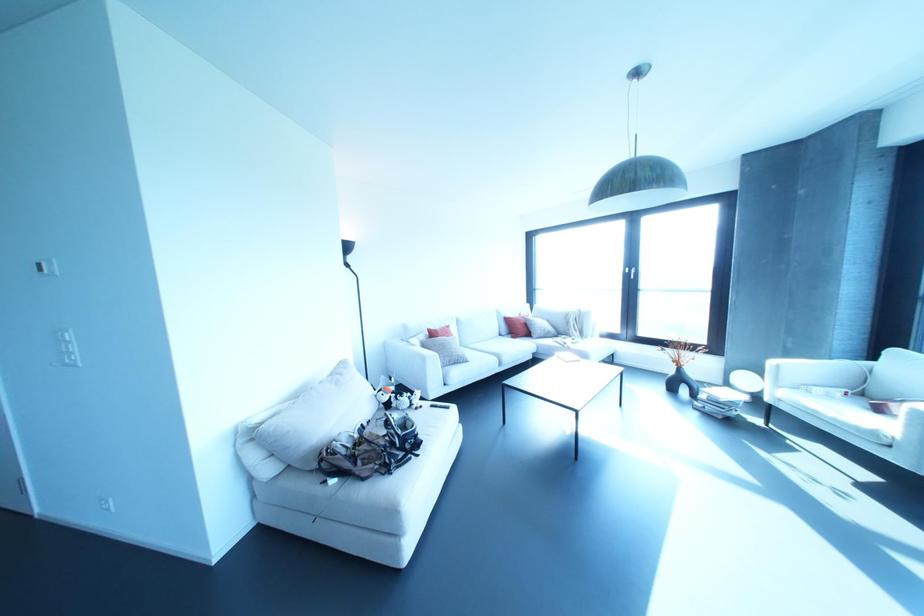
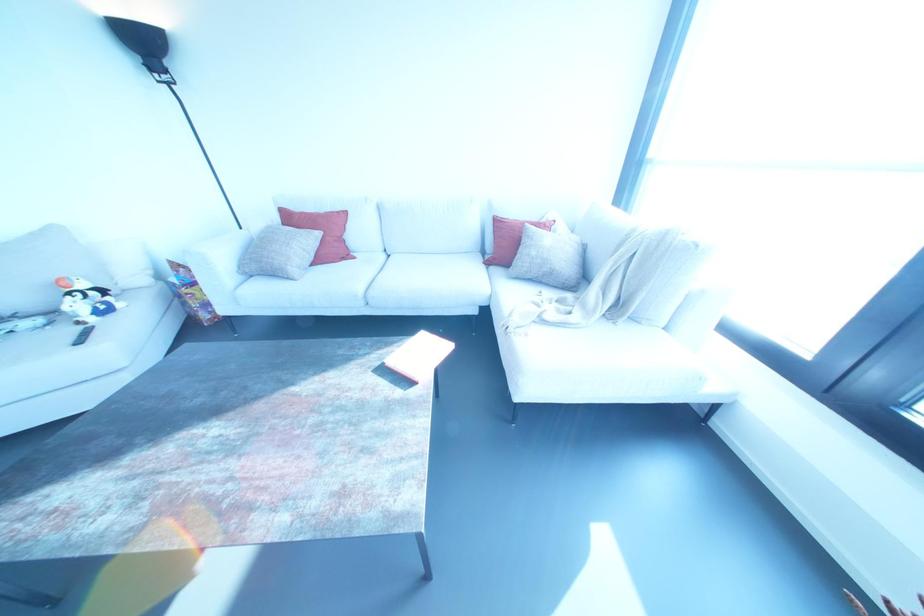
The point at (548, 331) is marked in the first image. Where is the corresponding point in the second image?

(551, 273)